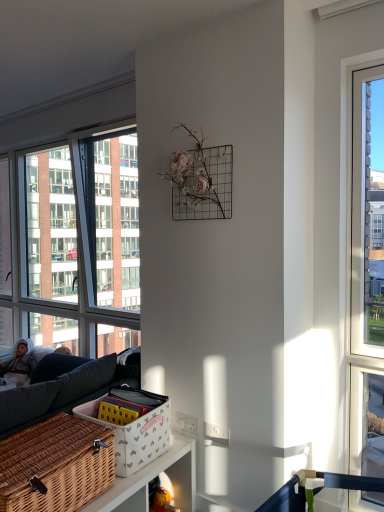
Question: Is woven brown picnic basket at lower left bigger than fluffy white doll at left?

Choices:
 (A) no
 (B) yes

Answer: (B)

Question: Is woven brown picnic basket at lower left further to camera compared to fluffy white doll at left?

Choices:
 (A) yes
 (B) no

Answer: (B)

Question: Can you confirm if woven brown picnic basket at lower left is wider than fluffy white doll at left?

Choices:
 (A) no
 (B) yes

Answer: (B)

Question: Considering the relative positions of woven brown picnic basket at lower left and fluffy white doll at left in the image provided, is woven brown picnic basket at lower left to the left of fluffy white doll at left from the viewer's perspective?

Choices:
 (A) no
 (B) yes

Answer: (A)

Question: Is woven brown picnic basket at lower left closer to the viewer compared to fluffy white doll at left?

Choices:
 (A) no
 (B) yes

Answer: (B)

Question: Is clear glass window at left in front of or behind white wicker basket at lower center in the image?

Choices:
 (A) front
 (B) behind

Answer: (B)

Question: Is clear glass window at left spatially inside white wicker basket at lower center, or outside of it?

Choices:
 (A) outside
 (B) inside

Answer: (A)

Question: From a real-world perspective, is clear glass window at left physically located above or below white wicker basket at lower center?

Choices:
 (A) above
 (B) below

Answer: (A)

Question: Considering the positions of clear glass window at left and white wicker basket at lower center in the image, is clear glass window at left taller or shorter than white wicker basket at lower center?

Choices:
 (A) short
 (B) tall

Answer: (B)

Question: Is woven brown picnic basket at lower left spatially inside white wicker basket at lower center, or outside of it?

Choices:
 (A) outside
 (B) inside

Answer: (A)

Question: Relative to white wicker basket at lower center, is woven brown picnic basket at lower left in front or behind?

Choices:
 (A) front
 (B) behind

Answer: (A)

Question: Visually, is woven brown picnic basket at lower left positioned to the left or to the right of white wicker basket at lower center?

Choices:
 (A) right
 (B) left

Answer: (B)

Question: Is woven brown picnic basket at lower left wider or thinner than white wicker basket at lower center?

Choices:
 (A) wide
 (B) thin

Answer: (A)

Question: Is fluffy white doll at left bigger or smaller than clear glass window at left?

Choices:
 (A) big
 (B) small

Answer: (B)

Question: In terms of height, does fluffy white doll at left look taller or shorter compared to clear glass window at left?

Choices:
 (A) short
 (B) tall

Answer: (A)